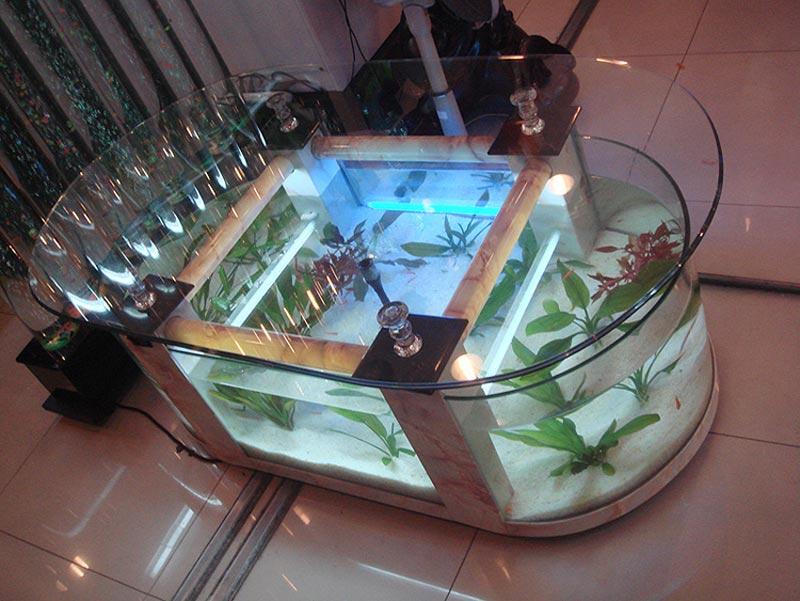
Locate an element on the screen. This screenshot has height=601, width=800. white tile floor is located at coordinates (661, 555).